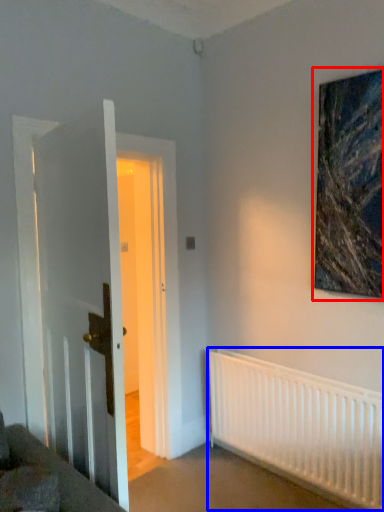
Question: Which object is further to the camera taking this photo, picture frame (highlighted by a red box) or radiator (highlighted by a blue box)?

Choices:
 (A) picture frame
 (B) radiator

Answer: (B)